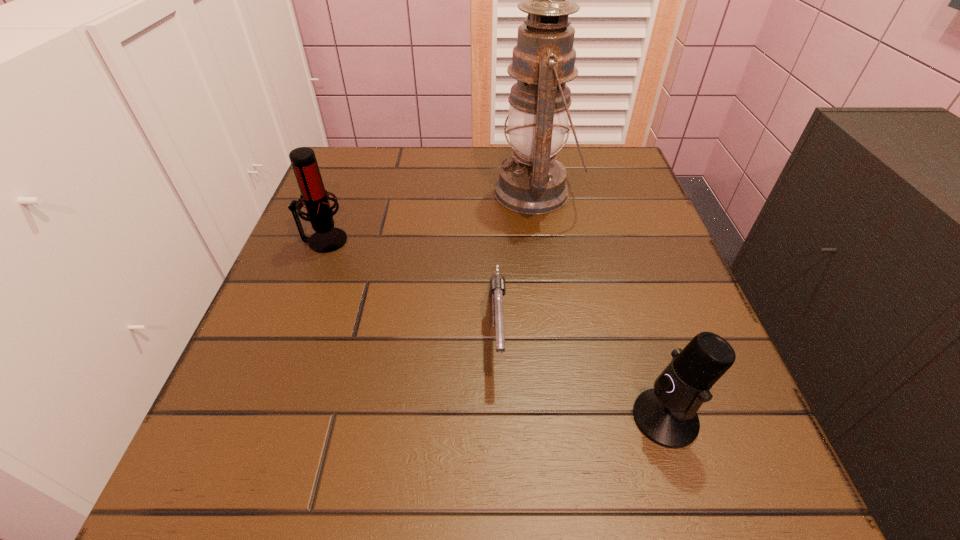
The image size is (960, 540). I want to click on object that is at the near right corner, so click(667, 415).

Locate an element on the screen. blank space at the far edge of the desktop is located at coordinates (440, 182).

This screenshot has width=960, height=540. In order to click on blank space at the left edge of the desktop in this screenshot , I will do `click(341, 291)`.

What are the coordinates of `vacant space at the right edge of the desktop` in the screenshot? It's located at (688, 285).

In the image, there is a desktop. Where is `vacant space at the far left corner`? The image size is (960, 540). vacant space at the far left corner is located at coordinates (326, 171).

Where is `free region at the near left corner`? This screenshot has height=540, width=960. free region at the near left corner is located at coordinates (290, 492).

In the image, there is a desktop. Where is `vacant space at the near right corner`? This screenshot has width=960, height=540. vacant space at the near right corner is located at coordinates (724, 459).

The height and width of the screenshot is (540, 960). I want to click on free spot between the farthest object and the third tallest object, so click(600, 305).

I want to click on vacant region between the farther microphone and the nearest object, so click(x=494, y=329).

Where is `vacant area that lies between the nearest object and the shortest object`? vacant area that lies between the nearest object and the shortest object is located at coordinates (581, 373).